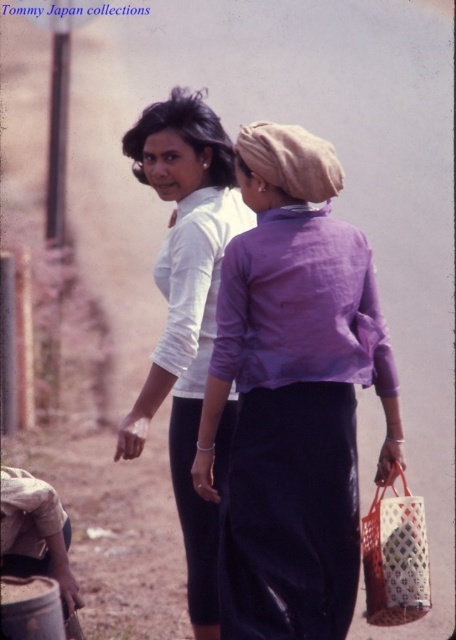
You are a photographer taking a picture of the matte white blouse at center and the white woven basket at lower right. Based on their positions, which object should you focus on first if you want to capture both in the same frame?

The matte white blouse at center is located above the white woven basket at lower right, so you should focus on the matte white blouse at center first to ensure both are in the frame.

You are a photographer trying to capture both the matte white blouse at center and the white woven basket at lower right in the same frame. Given that your camera has a maximum focus range of 90 centimeters, will you be able to include both subjects in the photo without moving closer?

The distance between the matte white blouse at center and the white woven basket at lower right is 91.36 centimeters, which exceeds the camera maximum focus range of 90 centimeters. Therefore, you cannot include both subjects in the photo without moving closer.

You are a photographer trying to capture the purple cotton shirt at center in the image. According to the coordinates provided, where exactly should you focus your camera lens?

The purple cotton shirt at center is located at coordinates point (294, 394), so you should focus your camera lens there to capture it accurately.